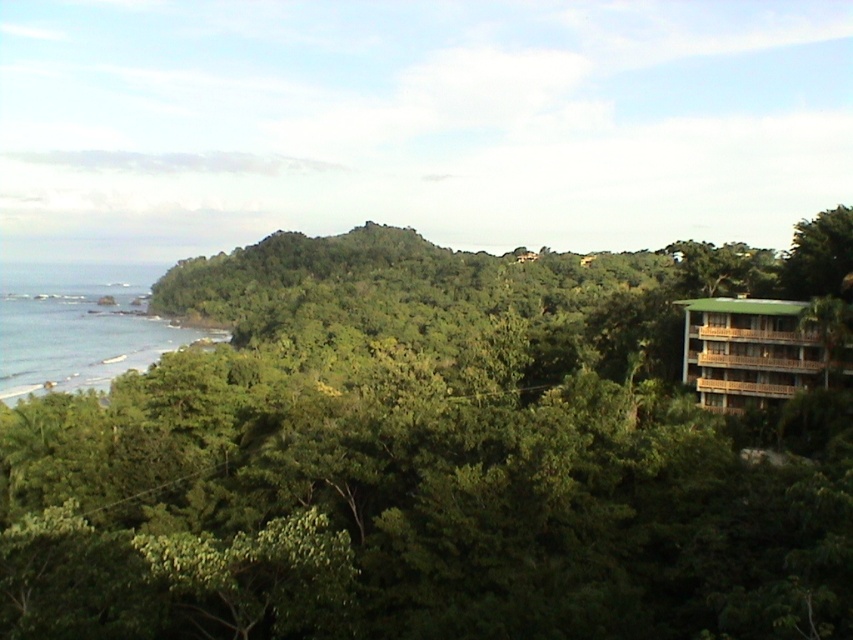
Question: Which object appears closest to the camera in this image?

Choices:
 (A) blue water at left
 (B) green leafy tree at center

Answer: (B)

Question: Estimate the real-world distances between objects in this image. Which object is closer to the green wooden hotel at right?

Choices:
 (A) blue water at left
 (B) green leafy tree at center

Answer: (B)

Question: Is green leafy tree at center above blue water at left?

Choices:
 (A) yes
 (B) no

Answer: (B)

Question: Which object appears closest to the camera in this image?

Choices:
 (A) blue water at left
 (B) green leafy tree at center

Answer: (B)

Question: Does blue water at left appear over green wooden hotel at right?

Choices:
 (A) yes
 (B) no

Answer: (A)

Question: Is green leafy tree at center further to the viewer compared to blue water at left?

Choices:
 (A) yes
 (B) no

Answer: (B)